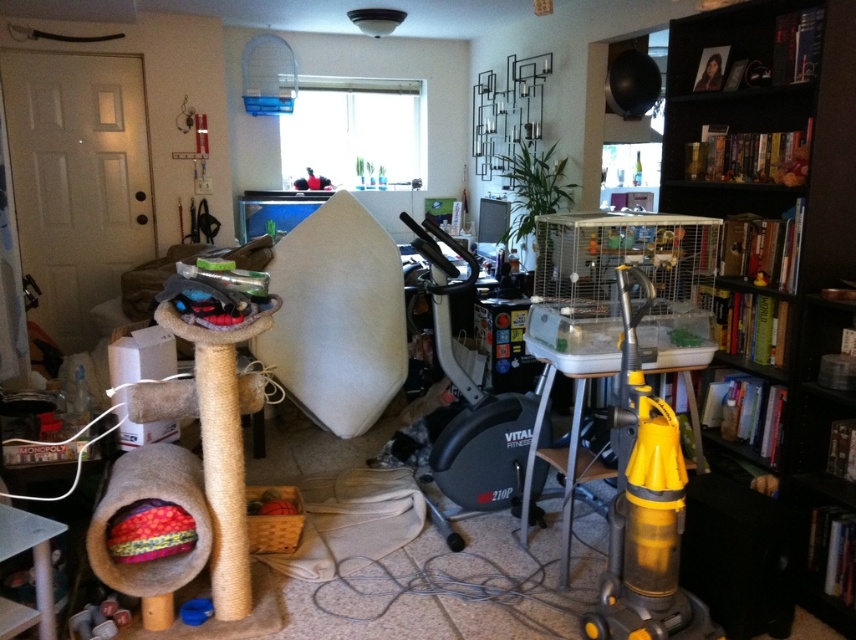
Between black wood bookshelf at right and yellow plastic vacuum cleaner at right, which one appears on the left side from the viewer's perspective?

yellow plastic vacuum cleaner at right

Is black wood bookshelf at right smaller than yellow plastic vacuum cleaner at right?

No, black wood bookshelf at right is not smaller than yellow plastic vacuum cleaner at right.

Does point (804, 317) lie behind point (629, 490)?

Yes, point (804, 317) is farther from viewer.

Find the location of `black wood bookshelf at right`. black wood bookshelf at right is located at coordinates (774, 305).